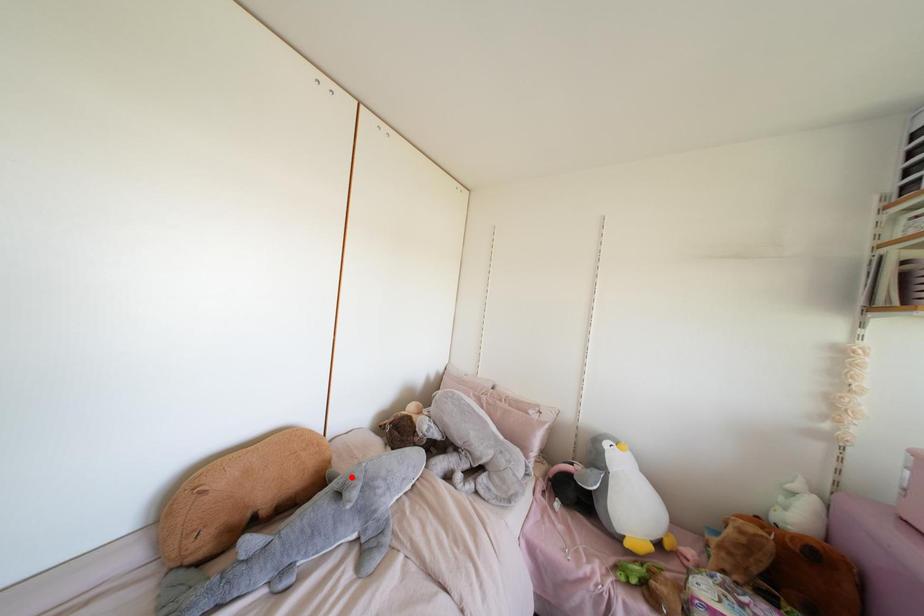
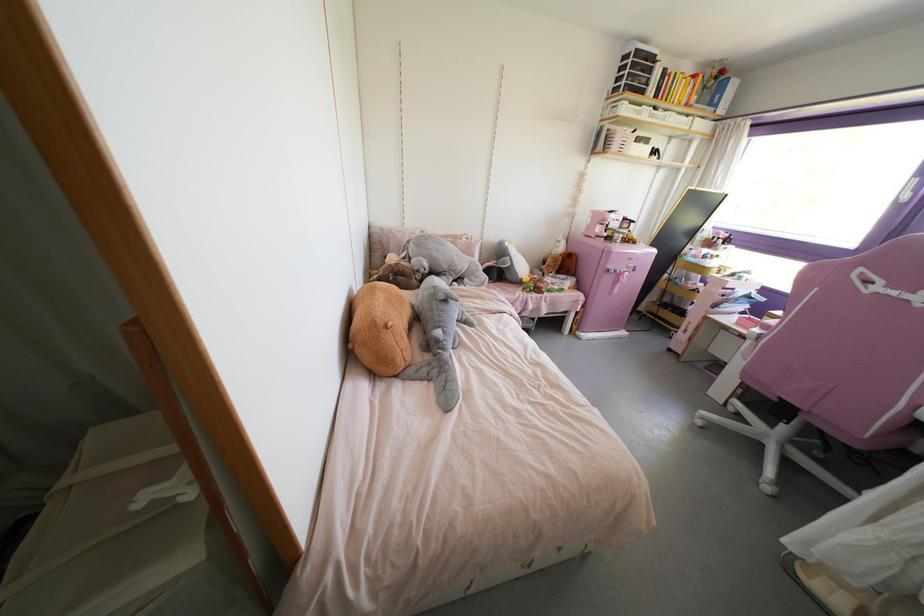
In the second image, find the point that corresponds to the highlighted location in the first image.

(444, 290)